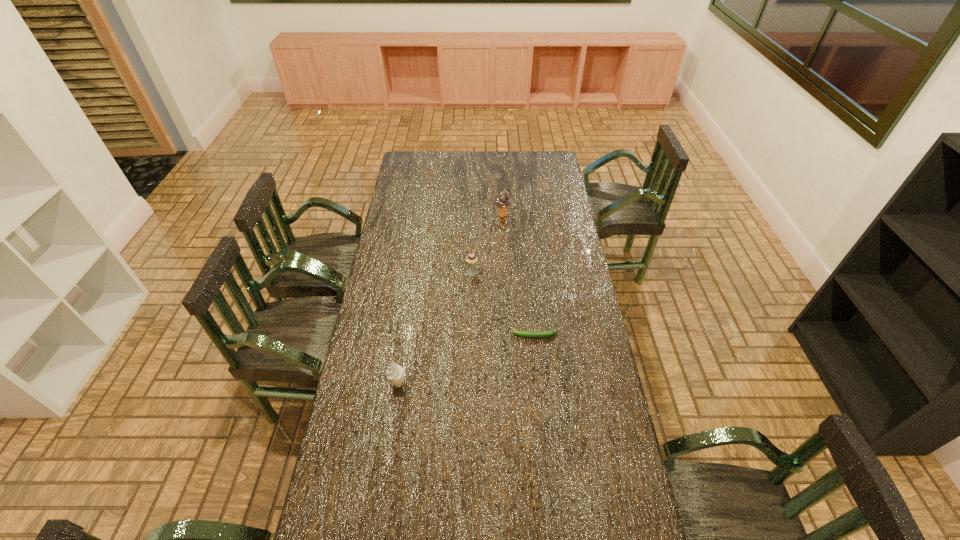
Image resolution: width=960 pixels, height=540 pixels. In order to click on empty space between the third nearest object and the rightmost icecream in this screenshot , I will do `click(488, 244)`.

Locate an element on the screen. object that is the third closest to the second farthest object is located at coordinates (395, 373).

Identify which object is the second closest to the farthest object. Please provide its 2D coordinates. Your answer should be formatted as a tuple, i.e. [(x, y)], where the tuple contains the x and y coordinates of a point satisfying the conditions above.

[(534, 334)]

The image size is (960, 540). What are the coordinates of `icecream that is the second closest to the zucchini` in the screenshot? It's located at (395, 373).

Choose which icecream is the second nearest neighbor to the rightmost icecream. Please provide its 2D coordinates. Your answer should be formatted as a tuple, i.e. [(x, y)], where the tuple contains the x and y coordinates of a point satisfying the conditions above.

[(395, 373)]

Identify the location of free space that satisfies the following two spatial constraints: 1. on the front side of the farthest icecream; 2. on the front-facing side of the nearest object. This screenshot has height=540, width=960. (513, 384).

At what (x,y) coordinates should I click in order to perform the action: click on free space that satisfies the following two spatial constraints: 1. on the back side of the rightmost icecream; 2. on the right side of the second icecream from right to left. Please return your answer as a coordinate pair (x, y). Looking at the image, I should click on (473, 215).